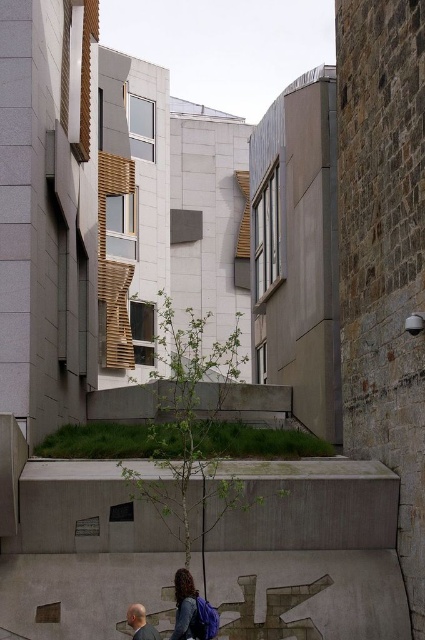
Looking at this image, you are a hiker who just arrived at this modern architectural site. You see the green leafy tree at center and the matte blue backpack at lower center. Which object is taller?

The green leafy tree at center is taller than the matte blue backpack at lower center according to the description.

You are a delivery person standing at the entrance of the modern building. You need to hand over a package to the gray hair man at lower left who is near the matte blue backpack at lower center. Can you reach him without crossing the textured ground with the letter K etched into the concrete?

The distance between the matte blue backpack at lower center and the gray hair man at lower left is 1.81 meters. Since the textured ground with the letter K is between them, you can reach him by walking around the perimeter of the textured area, maintaining a path that avoids stepping on the K etched concrete.

From the picture: You are a delivery person who needs to place a matte blue backpack at lower center next to the green leafy tree at center. Based on their sizes, will the backpack fit comfortably without overcrowding the space?

The green leafy tree at center might be wider than matte blue backpack at lower center, so there might not be enough space for the backpack to fit comfortably next to it without overcrowding.